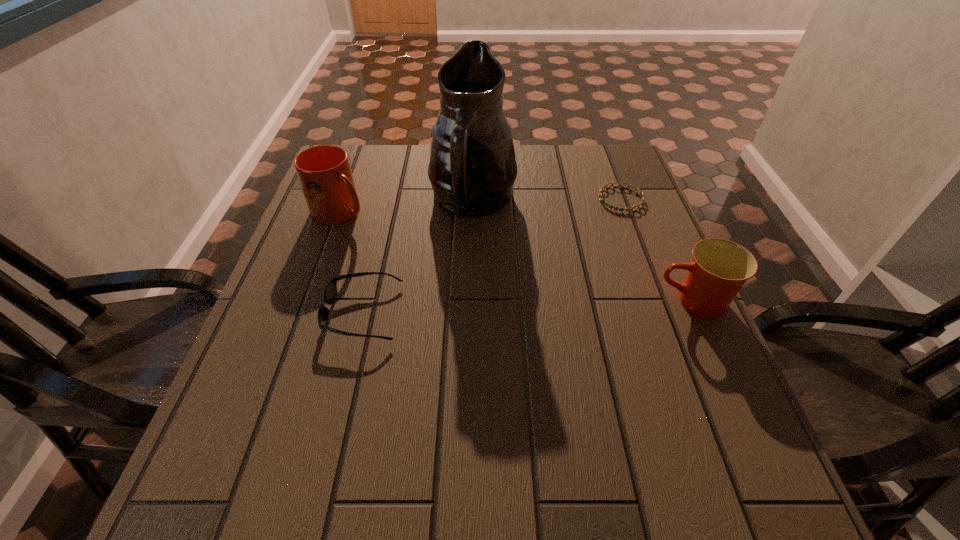
Image resolution: width=960 pixels, height=540 pixels. I want to click on free spot located from the spout of the pitcher, so click(583, 338).

Locate an element on the screen. The width and height of the screenshot is (960, 540). vacant space positioned 0.150m from the spout of the pitcher is located at coordinates (526, 270).

I want to click on vacant space located from the spout of the pitcher, so click(535, 281).

Image resolution: width=960 pixels, height=540 pixels. I want to click on vacant region located 0.190m on the surface of the bracelet showing star-shaped elements, so click(577, 247).

At what (x,y) coordinates should I click in order to perform the action: click on vacant space positioned on the surface of the bracelet showing star-shaped elements. Please return your answer as a coordinate pair (x, y). The image size is (960, 540). Looking at the image, I should click on (535, 293).

Where is `vacant space located on the surface of the bracelet showing star-shaped elements`? This screenshot has height=540, width=960. vacant space located on the surface of the bracelet showing star-shaped elements is located at coordinates (564, 261).

Identify the location of pitcher that is at the far edge. (472, 169).

I want to click on bracelet located in the far edge section of the desktop, so coord(603,201).

Identify the location of sunglasses that is at the left edge. The height and width of the screenshot is (540, 960). (330, 293).

Locate an element on the screen. Image resolution: width=960 pixels, height=540 pixels. mug that is at the left edge is located at coordinates (324, 172).